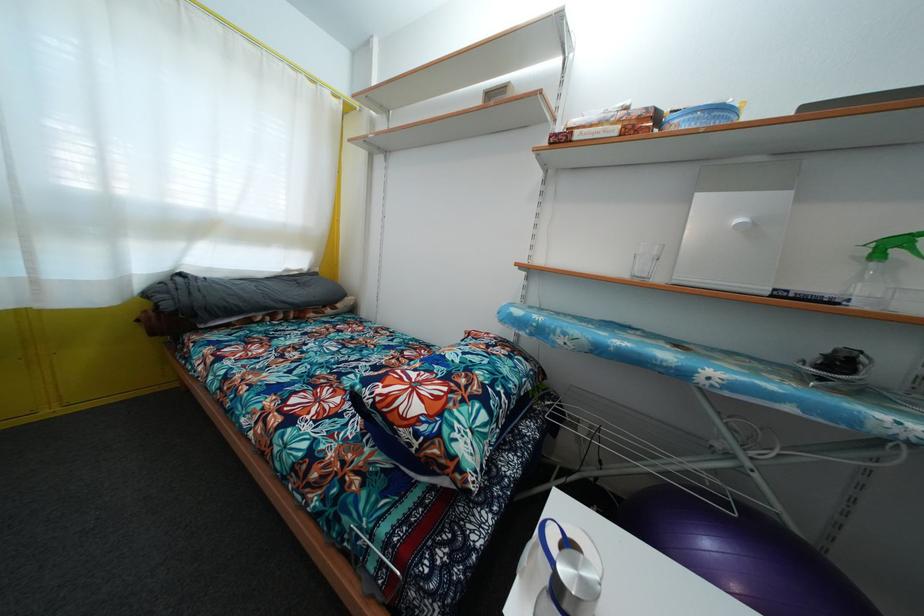
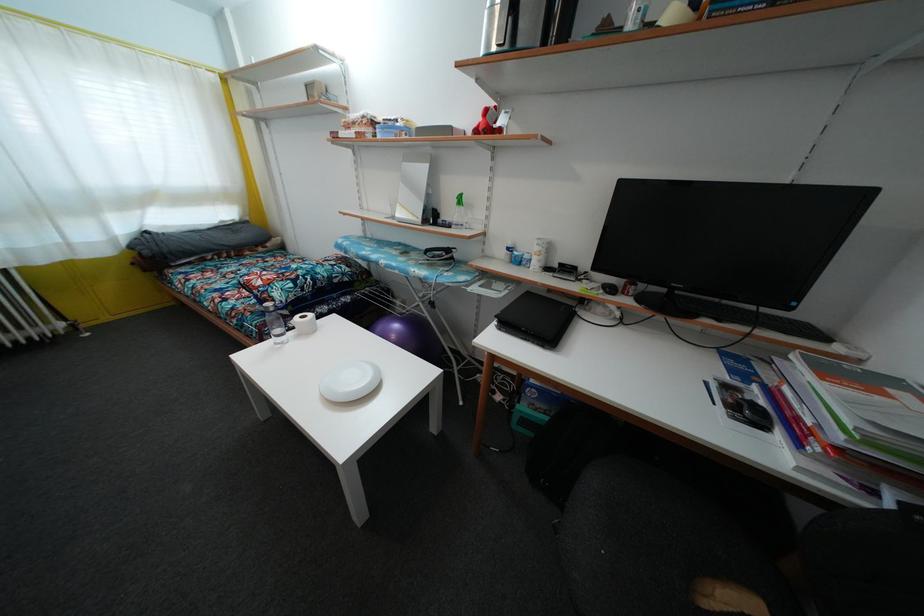
In the second image, find the point that corresponds to point (408, 440) in the first image.

(259, 299)